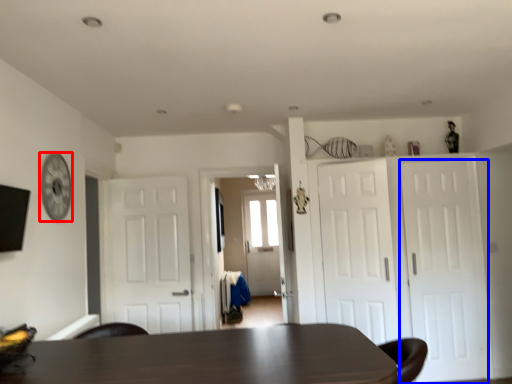
Question: Which point is further to the camera, clock (highlighted by a red box) or door (highlighted by a blue box)?

Choices:
 (A) clock
 (B) door

Answer: (B)